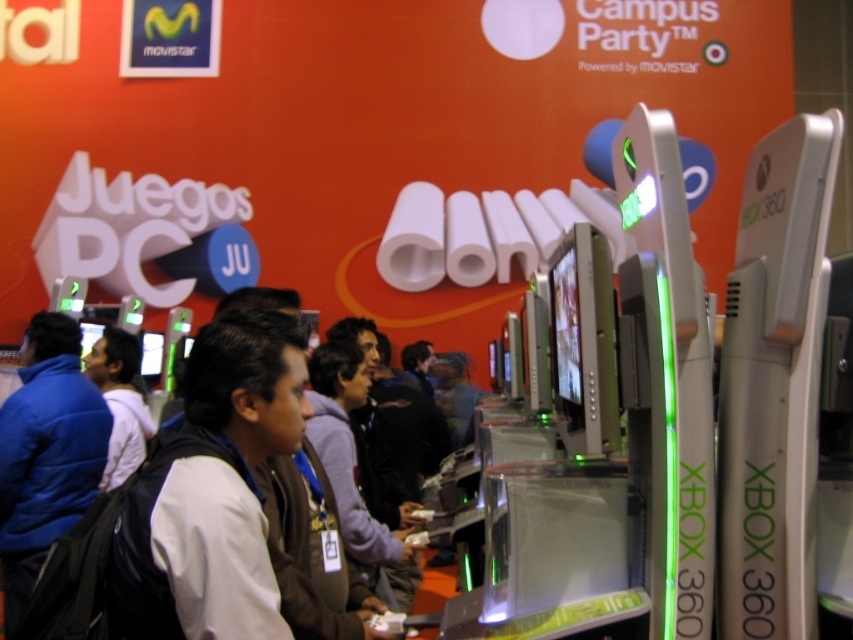
Can you confirm if blue puffy jacket at left is thinner than white matte shirt at center?

No, blue puffy jacket at left is not thinner than white matte shirt at center.

This screenshot has width=853, height=640. I want to click on blue puffy jacket at left, so click(45, 452).

You are a GUI agent. You are given a task and a screenshot of the screen. Output one action in this format:
    pyautogui.click(x=<x>, y=<y>)
    Task: Click on the blue puffy jacket at left
    The width and height of the screenshot is (853, 640).
    Given the screenshot: What is the action you would take?
    pyautogui.click(x=45, y=452)

Which is in front, point (44, 410) or point (398, 552)?

Point (398, 552) is in front.

Can you confirm if blue puffy jacket at left is positioned to the left of brown fabric jacket at center?

Indeed, blue puffy jacket at left is positioned on the left side of brown fabric jacket at center.

Is point (61, 342) farther from viewer compared to point (393, 604)?

Yes, point (61, 342) is farther from viewer.

I want to click on blue puffy jacket at left, so click(x=45, y=452).

Which is in front, point (389, 592) or point (135, 422)?

Point (389, 592) is more forward.

Is brown fabric jacket at center below white matte shirt at center?

Correct, brown fabric jacket at center is located below white matte shirt at center.

Image resolution: width=853 pixels, height=640 pixels. What do you see at coordinates (350, 461) in the screenshot? I see `brown fabric jacket at center` at bounding box center [350, 461].

This screenshot has height=640, width=853. I want to click on brown fabric jacket at center, so click(x=350, y=461).